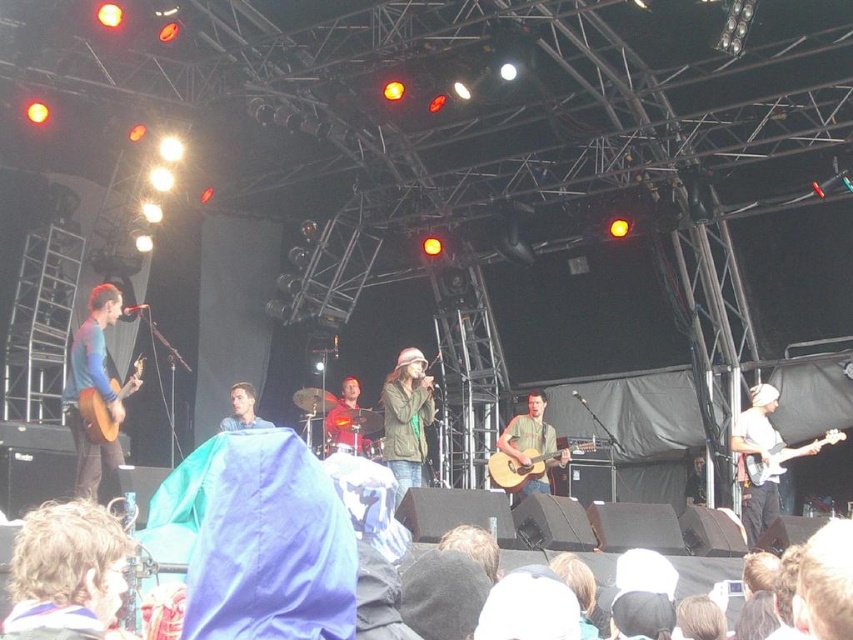
Does green textured shirt at center have a smaller size compared to acoustic wood guitar at left?

No, green textured shirt at center is not smaller than acoustic wood guitar at left.

In the scene shown: Does green textured shirt at center have a larger size compared to acoustic wood guitar at left?

Yes, green textured shirt at center is bigger than acoustic wood guitar at left.

The height and width of the screenshot is (640, 853). I want to click on green textured shirt at center, so click(531, 444).

Locate an element on the screen. This screenshot has height=640, width=853. green textured shirt at center is located at coordinates (531, 444).

Does matte black guitar at right have a smaller size compared to blue fabric at center?

No, matte black guitar at right is not smaller than blue fabric at center.

Does matte black guitar at right have a lesser width compared to blue fabric at center?

Incorrect, matte black guitar at right's width is not less than blue fabric at center's.

Is point (769, 442) more distant than point (241, 390)?

Yes, point (769, 442) is farther from viewer.

Find the location of a particular element. matte black guitar at right is located at coordinates (761, 460).

Between matte brown guitar at left and green matte jacket at center, which one is positioned higher?

Positioned higher is matte brown guitar at left.

Is matte brown guitar at left wider than green matte jacket at center?

Correct, the width of matte brown guitar at left exceeds that of green matte jacket at center.

Between point (83, 442) and point (396, 500), which one is positioned in front?

Point (396, 500) is in front.

You are a GUI agent. You are given a task and a screenshot of the screen. Output one action in this format:
    pyautogui.click(x=<x>, y=<y>)
    Task: Click on the matte brown guitar at left
    The image size is (853, 640).
    Given the screenshot: What is the action you would take?
    pyautogui.click(x=96, y=388)